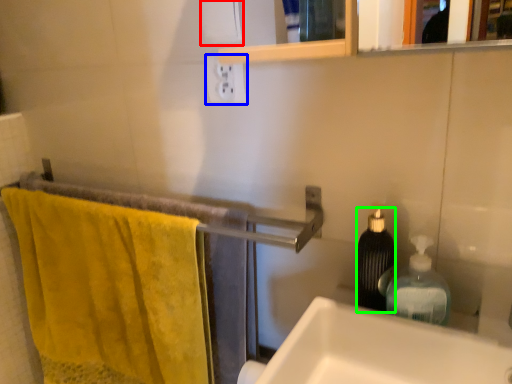
Question: Which is nearer to the toilet paper (highlighted by a red box)? electric outlet (highlighted by a blue box) or bottle (highlighted by a green box).

Choices:
 (A) electric outlet
 (B) bottle

Answer: (A)